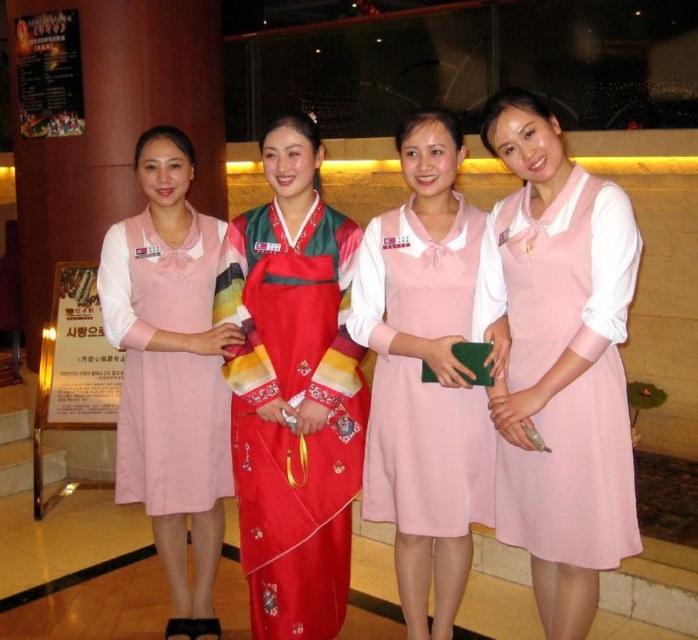
Question: Based on their relative distances, which object is farther from the red satin hanbok at center?

Choices:
 (A) matte pink dress at center
 (B) pink fabric dress at center

Answer: (B)

Question: Can you confirm if pink fabric dress at right is positioned to the left of matte pink dress at center?

Choices:
 (A) yes
 (B) no

Answer: (B)

Question: Can you confirm if red satin hanbok at center is positioned below matte pink dress at center?

Choices:
 (A) yes
 (B) no

Answer: (A)

Question: Which of the following is the closest to the observer?

Choices:
 (A) red satin hanbok at center
 (B) pink fabric dress at center

Answer: (A)

Question: Which point is farther to the camera?

Choices:
 (A) pink fabric dress at center
 (B) matte pink dress at center

Answer: (A)

Question: Does pink fabric dress at right lie in front of pink fabric dress at center?

Choices:
 (A) no
 (B) yes

Answer: (B)